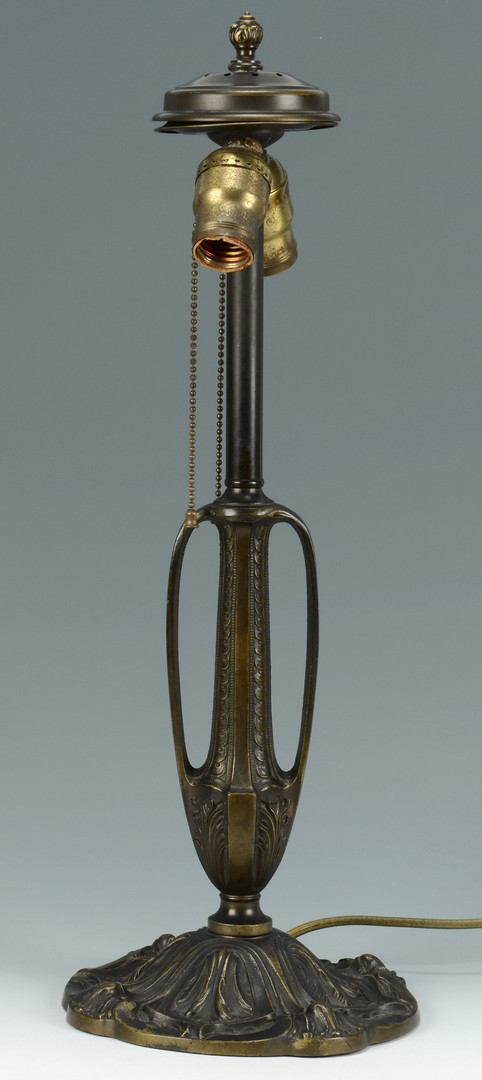
This screenshot has height=1080, width=482. In order to click on tablsocket in this screenshot , I will do `click(43, 1017)`, `click(226, 244)`.